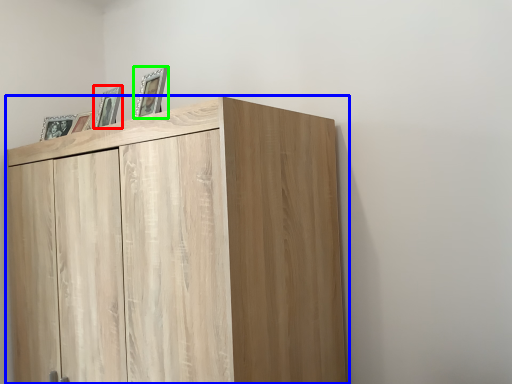
Question: Which is farther away from picture frame (highlighted by a red box)? cupboard (highlighted by a blue box) or picture frame (highlighted by a green box)?

Choices:
 (A) cupboard
 (B) picture frame

Answer: (A)